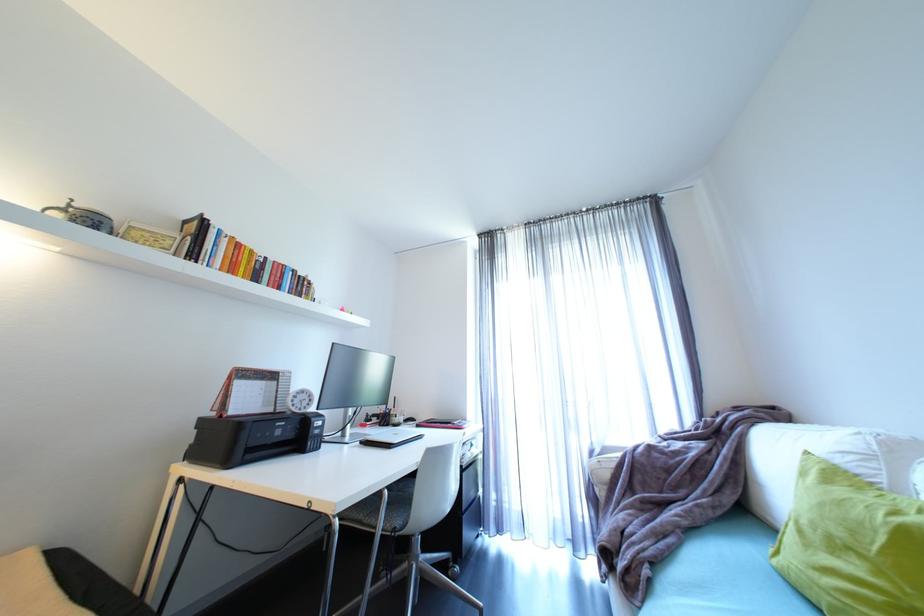
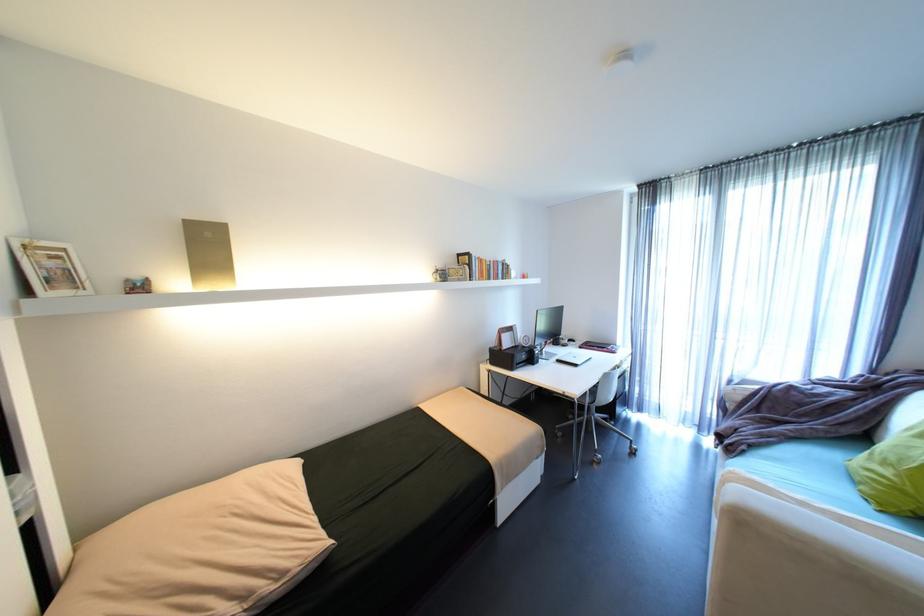
Where in the second image is the point corresponding to point (457, 424) from the first image?

(612, 347)